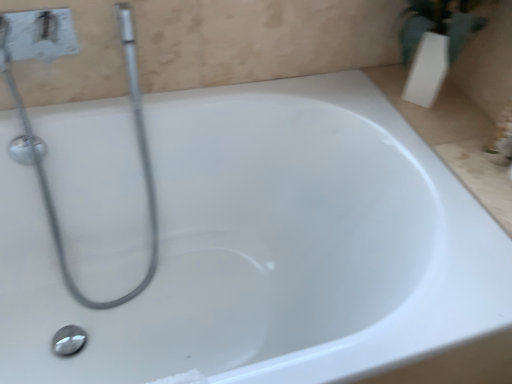
Question: Is polished metallic shower drain at bottom left outside satin chrome showerhead at upper left?

Choices:
 (A) no
 (B) yes

Answer: (B)

Question: From a real-world perspective, is polished metallic shower drain at bottom left located beneath satin chrome showerhead at upper left?

Choices:
 (A) yes
 (B) no

Answer: (A)

Question: Is the depth of polished metallic shower drain at bottom left less than that of satin chrome showerhead at upper left?

Choices:
 (A) yes
 (B) no

Answer: (B)

Question: Considering the relative sizes of polished metallic shower drain at bottom left and satin chrome showerhead at upper left in the image provided, is polished metallic shower drain at bottom left bigger than satin chrome showerhead at upper left?

Choices:
 (A) yes
 (B) no

Answer: (B)

Question: Is the depth of polished metallic shower drain at bottom left greater than that of satin chrome showerhead at upper left?

Choices:
 (A) yes
 (B) no

Answer: (A)

Question: Can you confirm if polished metallic shower drain at bottom left is positioned to the right of satin chrome showerhead at upper left?

Choices:
 (A) yes
 (B) no

Answer: (B)

Question: Considering the relative positions of satin chrome showerhead at upper left and polished metallic shower drain at bottom left in the image provided, is satin chrome showerhead at upper left in front of polished metallic shower drain at bottom left?

Choices:
 (A) no
 (B) yes

Answer: (B)

Question: Is the position of satin chrome showerhead at upper left more distant than that of polished metallic shower drain at bottom left?

Choices:
 (A) yes
 (B) no

Answer: (B)

Question: Can you confirm if satin chrome showerhead at upper left is taller than polished metallic shower drain at bottom left?

Choices:
 (A) yes
 (B) no

Answer: (A)

Question: Are satin chrome showerhead at upper left and polished metallic shower drain at bottom left located far from each other?

Choices:
 (A) no
 (B) yes

Answer: (A)

Question: Is satin chrome showerhead at upper left shorter than polished metallic shower drain at bottom left?

Choices:
 (A) yes
 (B) no

Answer: (B)

Question: Is satin chrome showerhead at upper left touching polished metallic shower drain at bottom left?

Choices:
 (A) yes
 (B) no

Answer: (B)

Question: Is polished metallic shower drain at bottom left to the left or to the right of satin chrome showerhead at upper left in the image?

Choices:
 (A) right
 (B) left

Answer: (B)